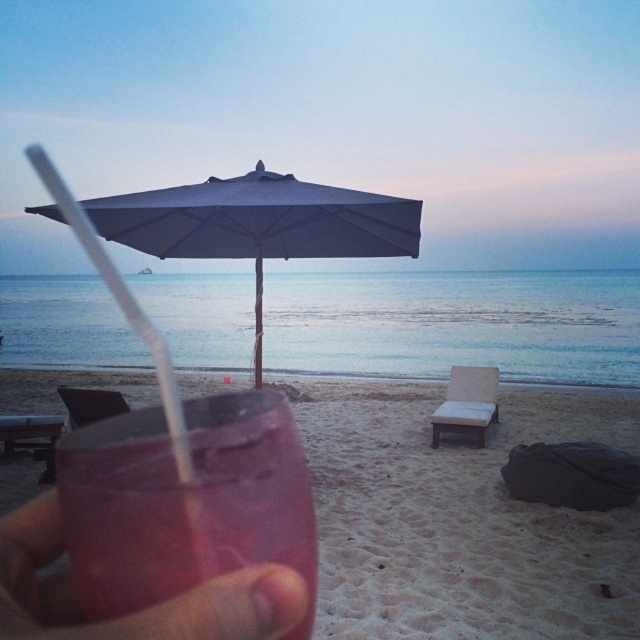
Consider the image. You are a photographer trying to capture the pink matte cup at lower left and the transparent plastic straw at lower left in focus. Since the cup is closer to you, will the straw be in focus if you focus on the cup?

The pink matte cup at lower left is closer to the viewer than the transparent plastic straw at lower left. If you focus on the cup, the straw may not be in focus because it is farther away, so depth of field might not cover both.

You are a bartender preparing a drink for a customer who wants the straw to be fully submerged in the drink. Based on the scene, can you tell if the transparent plastic straw at lower left is fully submerged in the pink matte cup at lower left?

The pink matte cup at lower left is positioned under the transparent plastic straw at lower left, meaning the straw is placed inside the cup, so it is fully submerged in the drink.

You are holding the transparent plastic straw at lower left and want to place it under the gray fabric umbrella at center. Is it already positioned correctly?

The gray fabric umbrella at center is located above the transparent plastic straw at lower left, so the straw is already positioned under the umbrella.